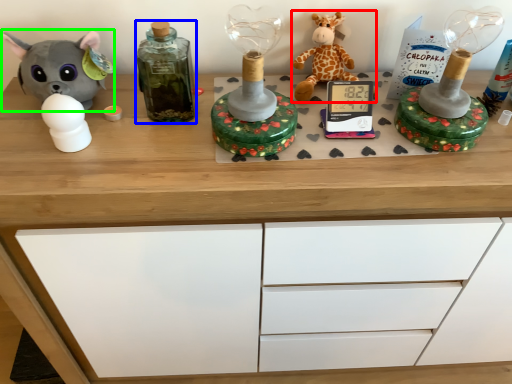
Question: Based on their relative distances, which object is nearer to toy (highlighted by a red box)? Choose from bottle (highlighted by a blue box) and toy (highlighted by a green box).

Choices:
 (A) bottle
 (B) toy

Answer: (A)